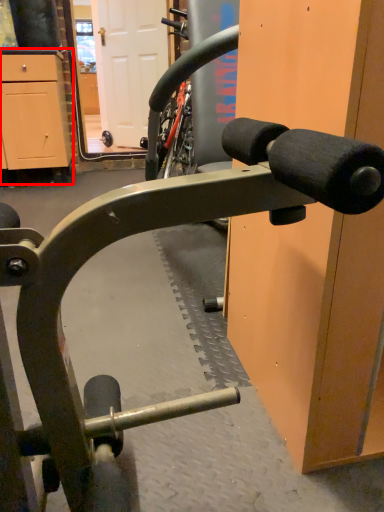
Question: From the image's perspective, what is the correct spatial relationship of cabinetry (annotated by the red box) in relation to door?

Choices:
 (A) above
 (B) below

Answer: (B)